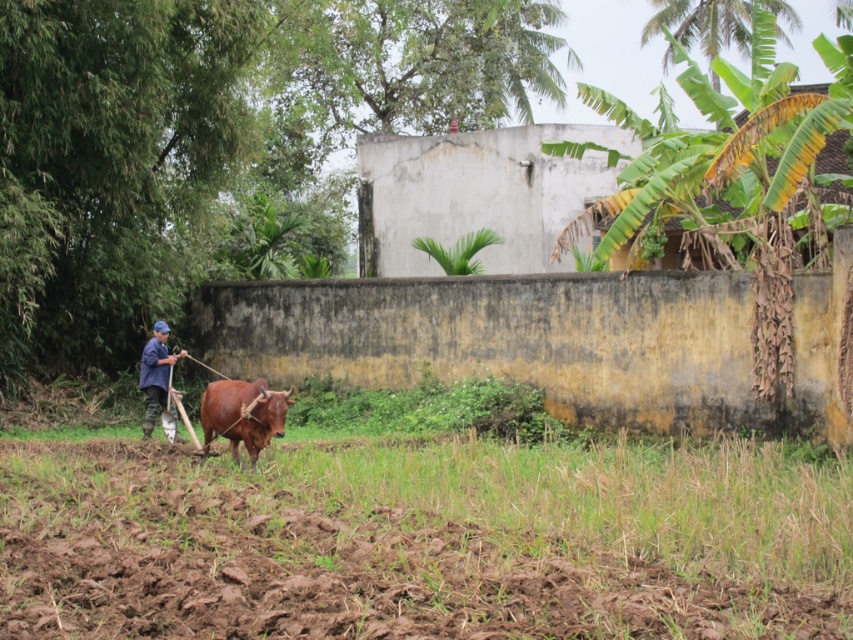
Question: Among these objects, which one is farthest from the camera?

Choices:
 (A) brown leather bull at center
 (B) blue fabric shirt at left
 (C) green grass at lower center

Answer: (B)

Question: Estimate the real-world distances between objects in this image. Which object is closer to the brown leather bull at center?

Choices:
 (A) blue fabric shirt at left
 (B) green grass at lower center

Answer: (A)

Question: From the image, what is the correct spatial relationship of green grass at lower center in relation to blue fabric shirt at left?

Choices:
 (A) above
 (B) below

Answer: (B)

Question: Can you confirm if green grass at lower center is smaller than blue fabric shirt at left?

Choices:
 (A) no
 (B) yes

Answer: (A)

Question: Which point appears closest to the camera in this image?

Choices:
 (A) (144, 372)
 (B) (750, 554)
 (C) (285, 396)

Answer: (B)

Question: Is green grass at lower center above blue fabric shirt at left?

Choices:
 (A) no
 (B) yes

Answer: (A)